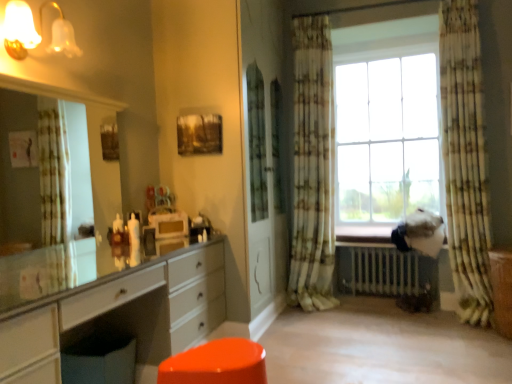
What do you see at coordinates (502, 289) in the screenshot? This screenshot has height=384, width=512. I see `brown wood file cabinet at lower right` at bounding box center [502, 289].

Identify the location of wooden textured picture frame at upper center. (199, 134).

What is the approximate height of matte glass sconce at upper left?

It is 10.70 inches.

I want to click on brown wood file cabinet at lower right, so click(x=502, y=289).

From a real-world perspective, which object rests below the other?

From a 3D spatial view, metallic silver radiator at lower center is below.

Is point (507, 279) closer or farther from the camera than point (354, 273)?

Point (507, 279) appears to be closer to the viewer than point (354, 273).

Is brown wood file cabinet at lower right not inside metallic silver radiator at lower center?

Indeed, brown wood file cabinet at lower right is completely outside metallic silver radiator at lower center.

Who is shorter, metallic silver radiator at lower center or floral fabric curtain at right, the first curtain viewed from the right?

Standing shorter between the two is metallic silver radiator at lower center.

From a real-world perspective, is metallic silver radiator at lower center beneath floral fabric curtain at right, the first curtain viewed from the right?

Yes, from a real-world perspective, metallic silver radiator at lower center is beneath floral fabric curtain at right, the first curtain viewed from the right.

From a real-world perspective, which is physically above, matte glass sconce at upper left or metallic silver radiator at lower center?

From a 3D spatial view, matte glass sconce at upper left is above.

Is there a large distance between matte glass sconce at upper left and metallic silver radiator at lower center?

Result: Yes, matte glass sconce at upper left and metallic silver radiator at lower center are quite far apart.

Can you confirm if matte glass sconce at upper left is smaller than metallic silver radiator at lower center?

Yes.

Can metallic silver radiator at lower center be found inside matte glass sconce at upper left?

No, matte glass sconce at upper left does not contain metallic silver radiator at lower center.

In the scene shown: Is glossy plastic stool at lower center further to the viewer compared to brown wood file cabinet at lower right?

No, glossy plastic stool at lower center is closer to the viewer.

Which is behind, point (240, 344) or point (489, 252)?

The point (489, 252) is farther from the camera.

How different are the orientations of glossy plastic stool at lower center and brown wood file cabinet at lower right in degrees?

There is a 89.9-degree angle between the facing directions of glossy plastic stool at lower center and brown wood file cabinet at lower right.

Is glossy plastic stool at lower center bigger or smaller than brown wood file cabinet at lower right?

Considering their sizes, glossy plastic stool at lower center takes up more space than brown wood file cabinet at lower right.

This screenshot has width=512, height=384. Find the location of `picture frame above the patterned fabric curtain at center, acting as the 2th curtain starting from the right (from the image's perspective)`. picture frame above the patterned fabric curtain at center, acting as the 2th curtain starting from the right (from the image's perspective) is located at coordinates (199, 134).

Does point (309, 134) come in front of point (205, 129)?

No.

Is white glossy chest of drawers at left shorter than glossy plastic stool at lower center?

Incorrect, the height of white glossy chest of drawers at left does not fall short of that of glossy plastic stool at lower center.

Is there a large distance between white glossy chest of drawers at left and glossy plastic stool at lower center?

That's not correct — white glossy chest of drawers at left is a little close to glossy plastic stool at lower center.

Who is more distant, white glossy chest of drawers at left or glossy plastic stool at lower center?

Positioned behind is glossy plastic stool at lower center.

From the image's perspective, is white glossy chest of drawers at left below glossy plastic stool at lower center?

Incorrect, from the image's perspective, white glossy chest of drawers at left is higher than glossy plastic stool at lower center.

Looking at this image, which object is closer to the camera taking this photo, wooden textured picture frame at upper center or matte glass sconce at upper left?

matte glass sconce at upper left is closer to the camera.

Considering the relative positions of wooden textured picture frame at upper center and matte glass sconce at upper left in the image provided, is wooden textured picture frame at upper center to the left of matte glass sconce at upper left from the viewer's perspective?

In fact, wooden textured picture frame at upper center is to the right of matte glass sconce at upper left.

Considering the relative sizes of wooden textured picture frame at upper center and matte glass sconce at upper left in the image provided, is wooden textured picture frame at upper center thinner than matte glass sconce at upper left?

Yes, wooden textured picture frame at upper center is thinner than matte glass sconce at upper left.

Could you tell me if wooden textured picture frame at upper center is facing matte glass sconce at upper left?

Yes.

Identify the location of radiator on the left of brown wood file cabinet at lower right. This screenshot has height=384, width=512. (384, 270).

You are a GUI agent. You are given a task and a screenshot of the screen. Output one action in this format:
    pyautogui.click(x=<x>, y=<y>)
    Task: Click on the curtain on the right of metallic silver radiator at lower center
    The height and width of the screenshot is (384, 512).
    Given the screenshot: What is the action you would take?
    pyautogui.click(x=465, y=159)

In the scene shown: Looking at the image, which one is located further to brown wood file cabinet at lower right, floral fabric curtain at right, the 2th curtain from the left, or white glossy chest of drawers at left?

white glossy chest of drawers at left is further to brown wood file cabinet at lower right.

Looking at this image, from the image, which object appears to be farther from patterned fabric curtain at center, acting as the 2th curtain starting from the right, matte glass sconce at upper left or brown wood file cabinet at lower right?

Among the two, matte glass sconce at upper left is located further to patterned fabric curtain at center, acting as the 2th curtain starting from the right.

Based on their spatial positions, is matte glass sconce at upper left or patterned fabric curtain at center, which appears as the first curtain when viewed from the left, closer to glossy plastic stool at lower center?

The object closer to glossy plastic stool at lower center is matte glass sconce at upper left.

Looking at this image, estimate the real-world distances between objects in this image. Which object is closer to floral fabric curtain at right, the 2th curtain from the left, wooden textured picture frame at upper center or metallic silver radiator at lower center?

metallic silver radiator at lower center is closer to floral fabric curtain at right, the 2th curtain from the left.

When comparing their distances from white glossy chest of drawers at left, does glossy plastic stool at lower center or wooden textured picture frame at upper center seem further?

wooden textured picture frame at upper center lies further to white glossy chest of drawers at left than the other object.

Which object lies further to the anchor point metallic silver radiator at lower center, brown wood file cabinet at lower right or wooden textured picture frame at upper center?

wooden textured picture frame at upper center is positioned further to the anchor metallic silver radiator at lower center.

Considering their positions, is white glossy chest of drawers at left positioned further to glossy plastic stool at lower center than brown wood file cabinet at lower right?

Among the two, brown wood file cabinet at lower right is located further to glossy plastic stool at lower center.

Estimate the real-world distances between objects in this image. Which object is further from glossy plastic stool at lower center, patterned fabric curtain at center, acting as the 2th curtain starting from the right, or brown wood file cabinet at lower right?

brown wood file cabinet at lower right.

The image size is (512, 384). Find the location of `bar stool between matte glass sconce at upper left and floral fabric curtain at right, the first curtain viewed from the right, from left to right`. bar stool between matte glass sconce at upper left and floral fabric curtain at right, the first curtain viewed from the right, from left to right is located at coordinates (216, 364).

This screenshot has height=384, width=512. Identify the location of bar stool located between white glossy chest of drawers at left and wooden textured picture frame at upper center in the depth direction. (216, 364).

The height and width of the screenshot is (384, 512). Identify the location of bar stool between wooden textured picture frame at upper center and floral fabric curtain at right, the first curtain viewed from the right. (216, 364).

Where is `picture frame between white glossy chest of drawers at left and floral fabric curtain at right, the first curtain viewed from the right, in the horizontal direction`? This screenshot has width=512, height=384. picture frame between white glossy chest of drawers at left and floral fabric curtain at right, the first curtain viewed from the right, in the horizontal direction is located at coordinates pyautogui.click(x=199, y=134).